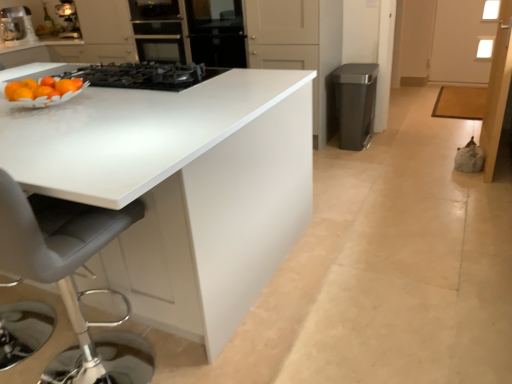
Question: Is metallic silver coffee maker at upper left to the right of satin metallic trash can at right from the viewer's perspective?

Choices:
 (A) no
 (B) yes

Answer: (A)

Question: From the image's perspective, is metallic silver coffee maker at upper left on satin metallic trash can at right?

Choices:
 (A) yes
 (B) no

Answer: (A)

Question: Is metallic silver coffee maker at upper left far away from satin metallic trash can at right?

Choices:
 (A) no
 (B) yes

Answer: (B)

Question: Can you confirm if metallic silver coffee maker at upper left is smaller than satin metallic trash can at right?

Choices:
 (A) yes
 (B) no

Answer: (A)

Question: Considering the relative sizes of metallic silver coffee maker at upper left and satin metallic trash can at right in the image provided, is metallic silver coffee maker at upper left shorter than satin metallic trash can at right?

Choices:
 (A) no
 (B) yes

Answer: (B)

Question: From a real-world perspective, does metallic silver coffee maker at upper left stand above satin metallic trash can at right?

Choices:
 (A) yes
 (B) no

Answer: (A)

Question: Can you confirm if black matte gas stove at upper center is taller than metallic silver coffee maker at upper left?

Choices:
 (A) yes
 (B) no

Answer: (B)

Question: Is black matte gas stove at upper center surrounding metallic silver coffee maker at upper left?

Choices:
 (A) no
 (B) yes

Answer: (A)

Question: Is black matte gas stove at upper center to the left of metallic silver coffee maker at upper left from the viewer's perspective?

Choices:
 (A) no
 (B) yes

Answer: (A)

Question: Is black matte gas stove at upper center bigger than metallic silver coffee maker at upper left?

Choices:
 (A) yes
 (B) no

Answer: (A)

Question: Is black matte gas stove at upper center in contact with metallic silver coffee maker at upper left?

Choices:
 (A) no
 (B) yes

Answer: (A)

Question: Is black matte gas stove at upper center thinner than metallic silver coffee maker at upper left?

Choices:
 (A) yes
 (B) no

Answer: (B)

Question: Is black glass oven at center beside satin metallic trash can at right?

Choices:
 (A) yes
 (B) no

Answer: (B)